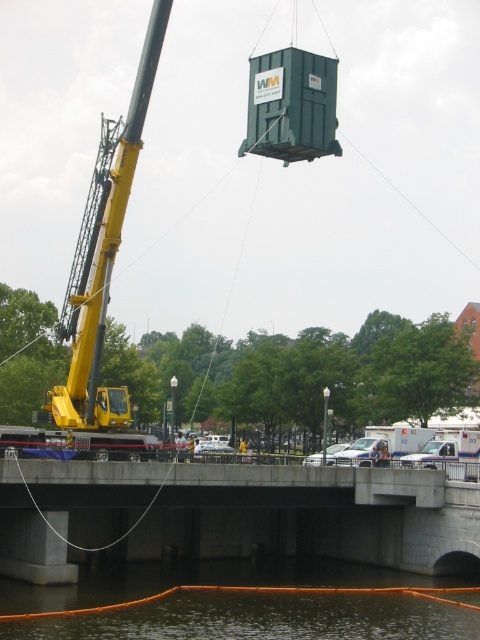
You are a construction worker planning to move a heavy object using the yellow metallic crane at left. The object needs to be placed on the concrete bridge at center. Based on their heights, will the crane be able to lower the object onto the bridge without any adjustments?

The concrete bridge at center has a lesser height compared to yellow metallic crane at left, so yes, the crane can lower the object onto the bridge since it is taller and can reach down to the lower position of the bridge.

Based on the scene description, where is the concrete bridge at center located in the image?

The concrete bridge at center is located at point (x=235, y=515) in the image.

You are a delivery truck driver who needs to cross the concrete bridge at center and the brown murky water at lower center. Which one has a wider passage for your truck?

The concrete bridge at center has a wider passage than the brown murky water at lower center because the concrete bridge at center is wider according to the description.